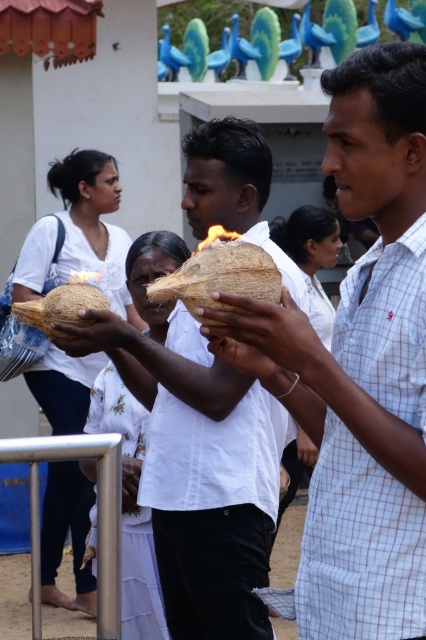
Question: Does coconut shell at center lie in front of smooth white coconut at center?

Choices:
 (A) no
 (B) yes

Answer: (A)

Question: Which object appears farthest from the camera in this image?

Choices:
 (A) smooth coconut at center
 (B) coconut shell at center
 (C) brown fibrous coconut at center

Answer: (B)

Question: Does brown matte coconut at center appear under smooth white coconut at center?

Choices:
 (A) yes
 (B) no

Answer: (B)

Question: Among these points, which one is farthest from the camera?

Choices:
 (A) (416, 96)
 (B) (233, 348)
 (C) (204, 240)

Answer: (C)

Question: Does matte white coconut at center appear on the left side of smooth white coconut at center?

Choices:
 (A) no
 (B) yes

Answer: (A)

Question: Based on their relative distances, which object is nearer to the matte white coconut at center?

Choices:
 (A) matte coconut at center
 (B) brown fibrous coconut at center

Answer: (B)